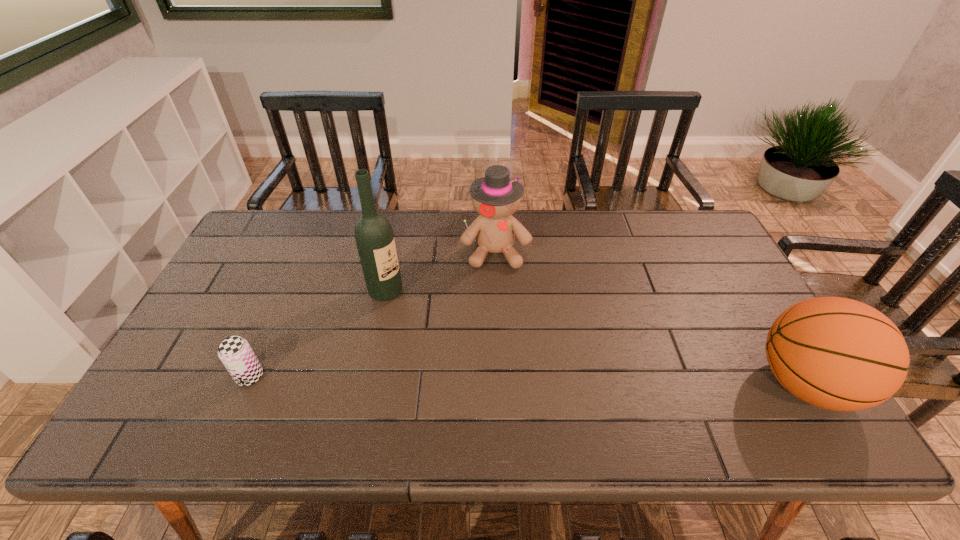
What are the coordinates of `free space on the desktop that is between the shortest object and the basketball and is positioned on the front-facing side of the farthest object` in the screenshot? It's located at (509, 380).

At what (x,y) coordinates should I click in order to perform the action: click on free spot on the desktop that is between the shortest object and the rightmost object and is positioned on the labeled side of the second object from left to right. Please return your answer as a coordinate pair (x, y). This screenshot has width=960, height=540. Looking at the image, I should click on (516, 380).